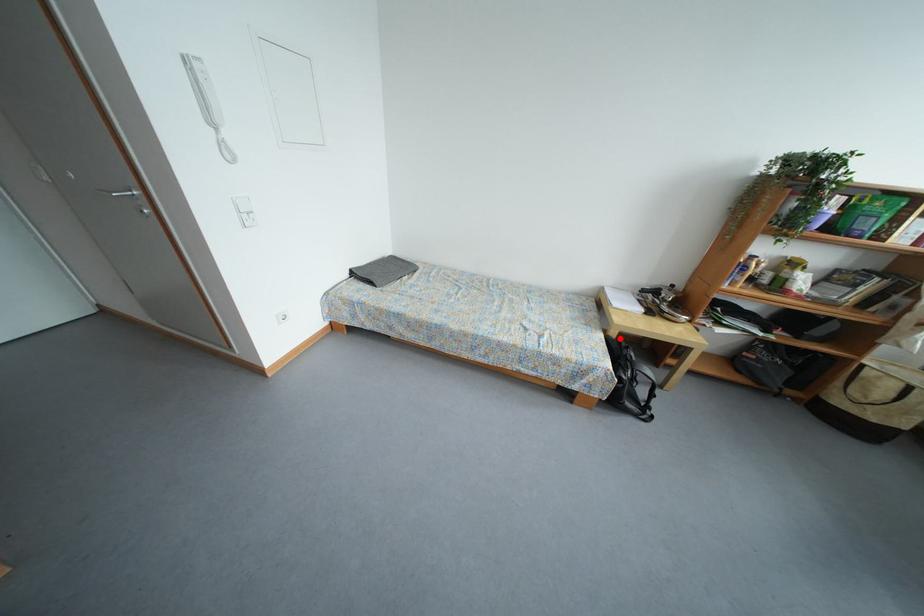
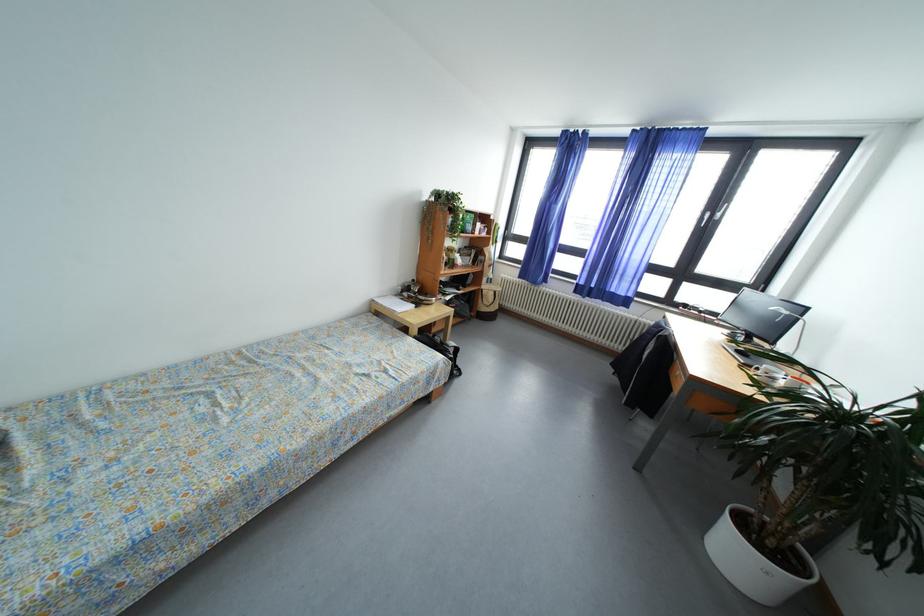
Question: I am providing you with two images of the same scene from different viewpoints. Given a red point in image1, look at the same physical point in image2. Is it:

Choices:
 (A) Closer to the viewpoint
 (B) Farther from the viewpoint

Answer: (A)